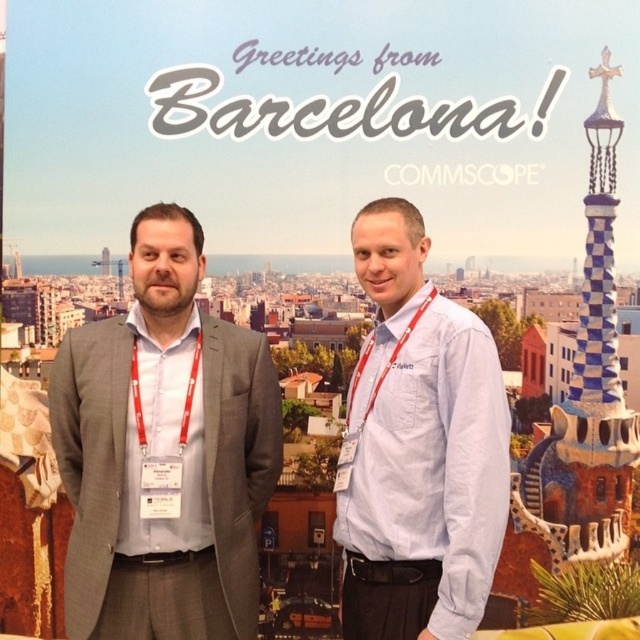
Which is above, gray suit at left or light blue shirt at center?

light blue shirt at center

Which is behind, point (212, 413) or point (381, 392)?

The point (381, 392) is behind.

The width and height of the screenshot is (640, 640). What are the coordinates of `gray suit at left` in the screenshot? It's located at (164, 452).